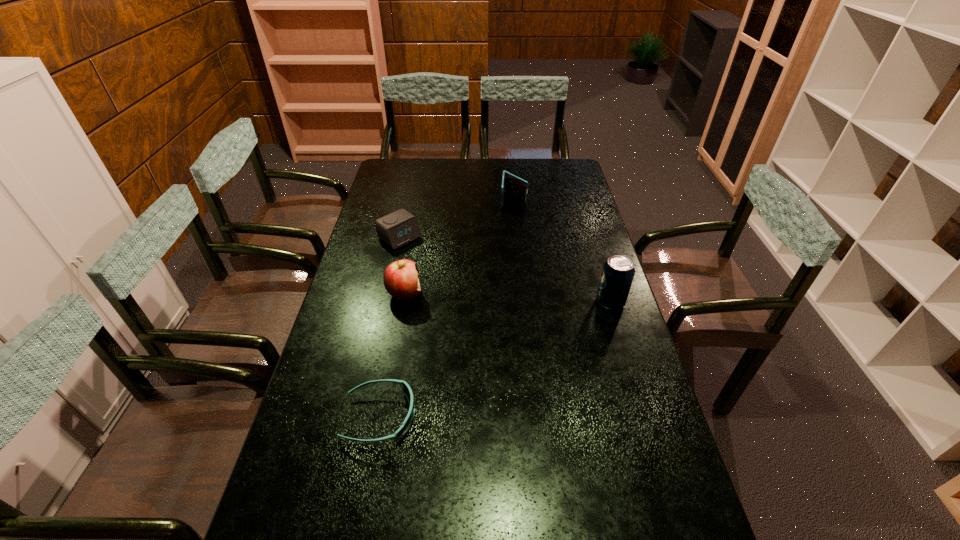
Where is `sunglasses present at the left edge`? This screenshot has width=960, height=540. sunglasses present at the left edge is located at coordinates (406, 389).

Locate an element on the screen. apple at the left edge is located at coordinates (400, 278).

Find the location of a particular element. The image size is (960, 540). alarm clock present at the left edge is located at coordinates (396, 229).

Where is `object present at the right edge`? Image resolution: width=960 pixels, height=540 pixels. object present at the right edge is located at coordinates (618, 272).

Where is `blank space at the far edge of the desktop`? This screenshot has width=960, height=540. blank space at the far edge of the desktop is located at coordinates (440, 172).

Where is `free point at the left edge`? This screenshot has height=540, width=960. free point at the left edge is located at coordinates (365, 313).

Where is `free region at the right edge`? The height and width of the screenshot is (540, 960). free region at the right edge is located at coordinates (602, 312).

Identify the location of vacant space at the near left corner of the desktop. The image size is (960, 540). (301, 521).

Where is `vacant region at the far right corner of the desktop`? This screenshot has height=540, width=960. vacant region at the far right corner of the desktop is located at coordinates (569, 180).

Locate an element on the screen. The height and width of the screenshot is (540, 960). vacant space that is in between the apple and the rightmost object is located at coordinates (508, 298).